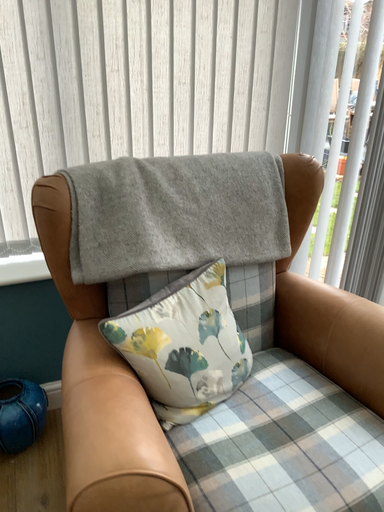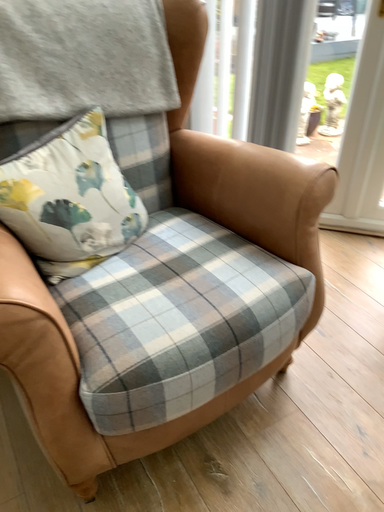
Question: How did the camera likely rotate when shooting the video?

Choices:
 (A) rotated upward
 (B) rotated downward

Answer: (B)